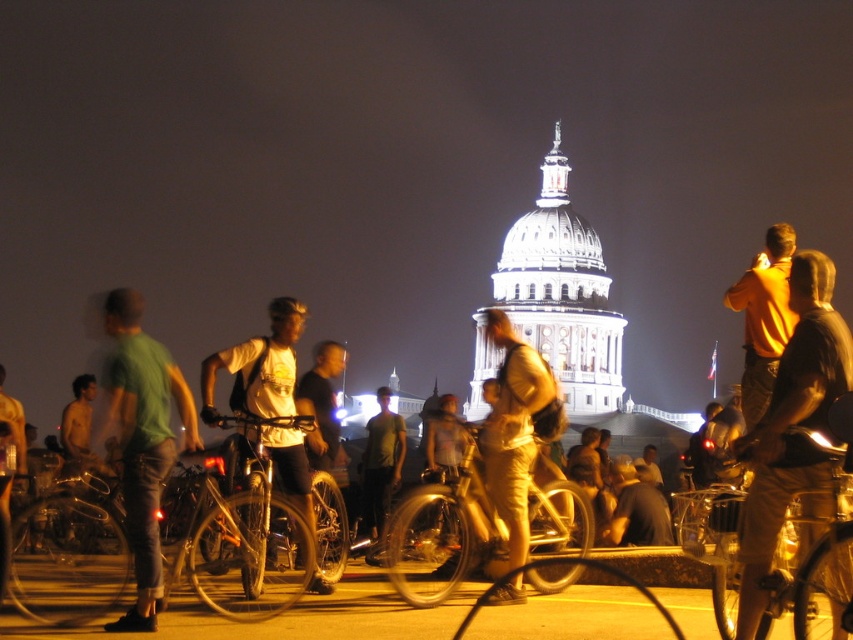
Question: Which point is farther to the camera?

Choices:
 (A) [396, 548]
 (B) [850, 576]

Answer: (A)

Question: Can you confirm if white matte shirt at center is smaller than light yellow shirt at center?

Choices:
 (A) yes
 (B) no

Answer: (B)

Question: Which object appears closest to the camera in this image?

Choices:
 (A) dark brown leather jacket at center
 (B) yellow matte shirt at upper right

Answer: (B)

Question: Which object appears farthest from the camera in this image?

Choices:
 (A) white matte shirt at center
 (B) metallic gold bicycle at center

Answer: (A)

Question: Is tan cotton pants at center further to camera compared to white matte shirt at center?

Choices:
 (A) yes
 (B) no

Answer: (B)

Question: Can you confirm if metallic gold bicycle at center is positioned to the right of dark brown leather jacket at center?

Choices:
 (A) no
 (B) yes

Answer: (B)